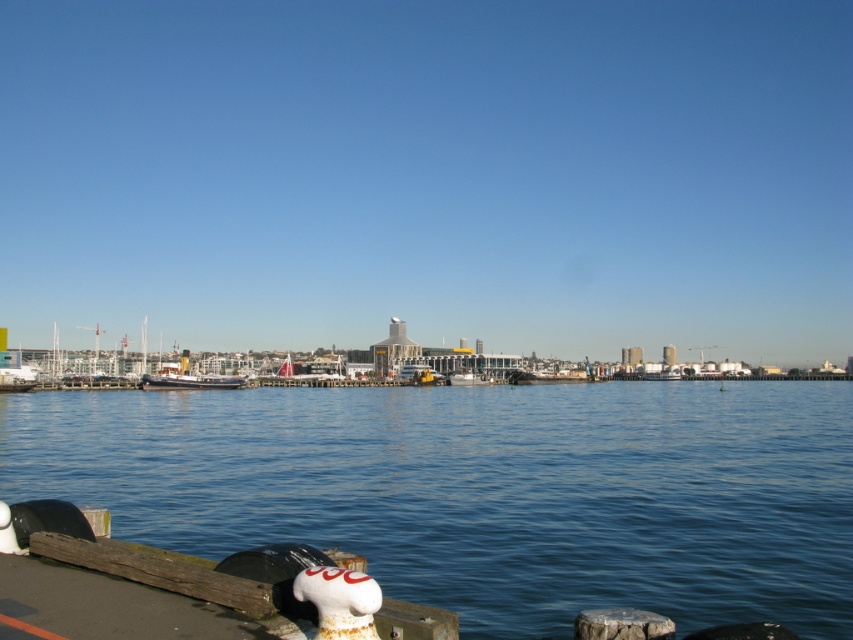
You are a maintenance worker on the dock and need to determine which vessel requires more vertical clearance for a crane operation. Based on the scene, which one is taller between the wooden ship at center and the white matte boat at center?

The wooden ship at center is much taller than the white matte boat at center, so it requires more vertical clearance for the crane operation.

You are planning to dock your new boat at the waterfront. You see a wooden ship at center and a white matte boat at center. Which one takes up more space on the dock?

The wooden ship at center is larger in size than the white matte boat at center, so it takes up more space on the dock.

You are standing on the wooden dock and want to observe the blue water at center and the wooden ship at center. Which object is closer to you?

The blue water at center is closer to you because it is in front of the wooden ship at center.